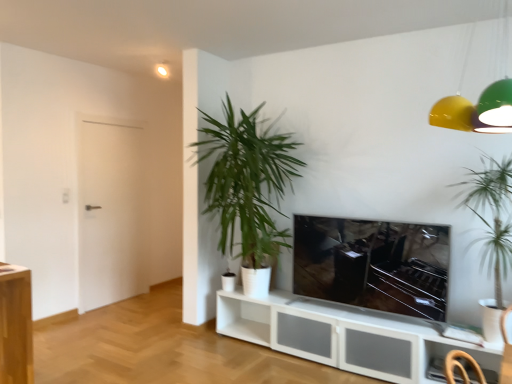
Question: Would you say yellow matte lampshade at upper right is inside or outside matte black tv at center?

Choices:
 (A) inside
 (B) outside

Answer: (B)

Question: Is point (472, 109) positioned closer to the camera than point (371, 246)?

Choices:
 (A) farther
 (B) closer

Answer: (B)

Question: Considering the real-world distances, which object is closest to the matte black tv at center?

Choices:
 (A) yellow matte lampshade at upper right
 (B) green leafy plant at right, the second houseplant positioned from the back
 (C) white matte door at left
 (D) green leafy plant at center, the 2th houseplant when ordered from front to back

Answer: (B)

Question: Considering the real-world distances, which object is farthest from the yellow matte lampshade at upper right?

Choices:
 (A) white matte door at left
 (B) matte black tv at center
 (C) green leafy plant at right, the second houseplant positioned from the back
 (D) green leafy plant at center, marked as the first houseplant in a back-to-front arrangement

Answer: (A)